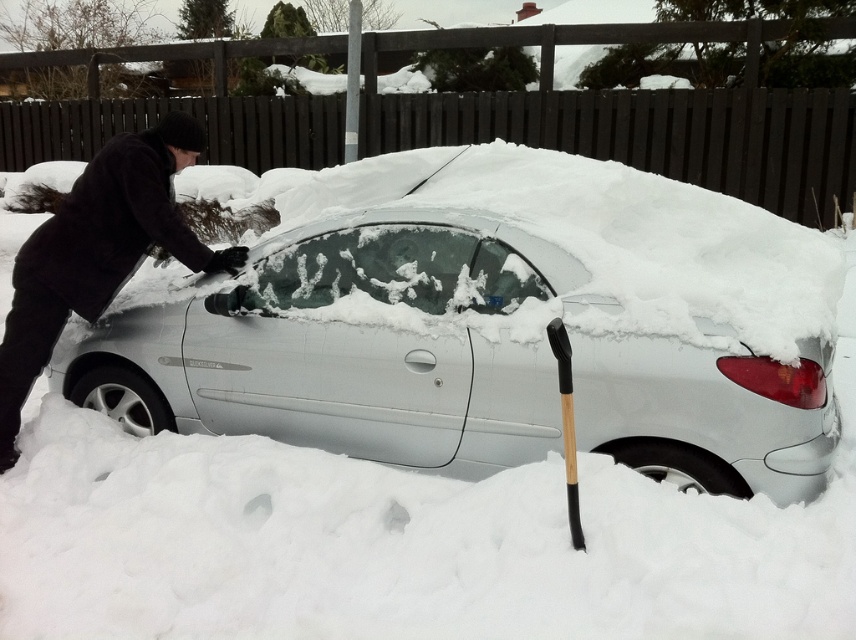
Question: Does black woolen hat at upper left have a greater width compared to transparent ice windshield at center?

Choices:
 (A) yes
 (B) no

Answer: (B)

Question: Which object is the closest to the white matte car at center?

Choices:
 (A) black woolen hat at upper left
 (B) black wood shovel at lower right

Answer: (A)

Question: Is white matte car at center above transparent ice windshield at center?

Choices:
 (A) yes
 (B) no

Answer: (B)

Question: Which is nearer to the transparent ice windshield at center?

Choices:
 (A) white matte car at center
 (B) black wood shovel at lower right

Answer: (A)

Question: Is the position of black woolen hat at upper left more distant than that of black wood shovel at lower right?

Choices:
 (A) no
 (B) yes

Answer: (B)

Question: Which object is closer to the camera taking this photo?

Choices:
 (A) black woolen hat at upper left
 (B) black wood shovel at lower right
 (C) transparent ice windshield at center
 (D) white matte car at center

Answer: (B)